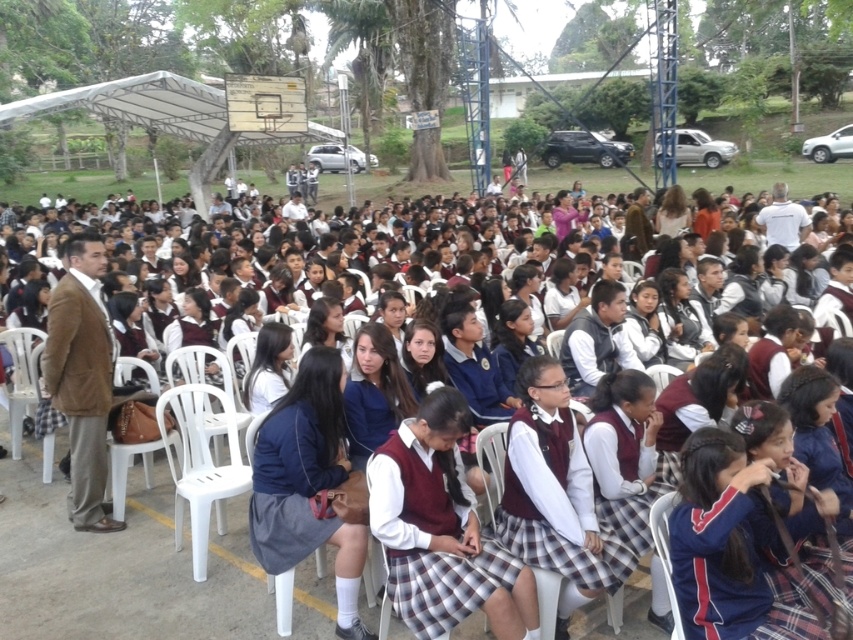
Question: Where is maroon uniformed students at center located in relation to white plastic chair at center in the image?

Choices:
 (A) left
 (B) right

Answer: (A)

Question: Can you confirm if maroon uniformed students at center is positioned below white plastic chair at lower right?

Choices:
 (A) no
 (B) yes

Answer: (B)

Question: Which is nearer to the white plastic chair at center?

Choices:
 (A) white plastic chair at lower right
 (B) maroon uniformed students at center

Answer: (B)

Question: Is the position of maroon uniformed students at center less distant than that of white plastic chair at lower right?

Choices:
 (A) no
 (B) yes

Answer: (A)

Question: Among these objects, which one is farthest from the camera?

Choices:
 (A) white plastic chair at center
 (B) white plastic chair at lower right

Answer: (A)

Question: Estimate the real-world distances between objects in this image. Which object is farther from the maroon uniformed students at center?

Choices:
 (A) white plastic chair at lower right
 (B) white plastic chair at center

Answer: (A)